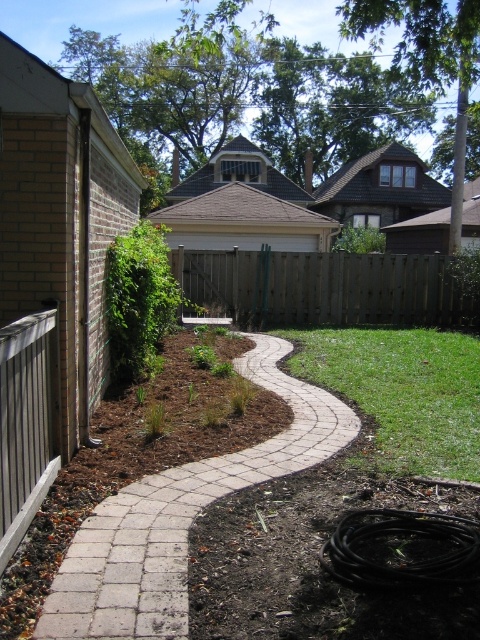
Question: Observing the image, what is the correct spatial positioning of green grass at lower right in reference to brown wood fence at center?

Choices:
 (A) right
 (B) left

Answer: (B)

Question: Is white brick path at center to the right of brown wood fence at center from the viewer's perspective?

Choices:
 (A) no
 (B) yes

Answer: (A)

Question: Which object is the closest to the white brick path at center?

Choices:
 (A) brown wood fence at center
 (B) green grass at lower right

Answer: (B)

Question: Which of the following is the farthest from the observer?

Choices:
 (A) (249, 380)
 (B) (272, 288)

Answer: (B)

Question: From the image, what is the correct spatial relationship of white brick path at center in relation to brown wood fence at center?

Choices:
 (A) left
 (B) right

Answer: (A)

Question: Among these objects, which one is farthest from the camera?

Choices:
 (A) white brick path at center
 (B) brown wood fence at center
 (C) green grass at lower right

Answer: (B)